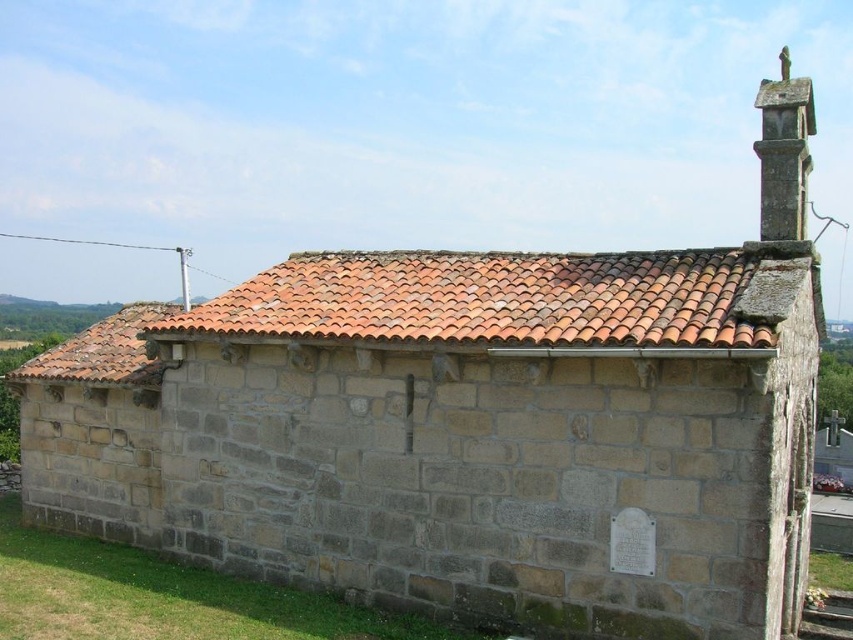
Question: Which point is farther to the camera?

Choices:
 (A) terracotta tiles at upper center
 (B) smooth stone chimney at upper right

Answer: (B)

Question: Which point is closer to the camera?

Choices:
 (A) (761, 122)
 (B) (680, 301)

Answer: (B)

Question: Is terracotta tiles at upper center to the left of smooth stone chimney at upper right from the viewer's perspective?

Choices:
 (A) yes
 (B) no

Answer: (A)

Question: Does terracotta tiles at upper center appear on the left side of smooth stone chimney at upper right?

Choices:
 (A) no
 (B) yes

Answer: (B)

Question: Which point appears closest to the camera in this image?

Choices:
 (A) (703, 312)
 (B) (767, 200)

Answer: (A)

Question: Is terracotta tiles at upper center positioned behind smooth stone chimney at upper right?

Choices:
 (A) no
 (B) yes

Answer: (A)